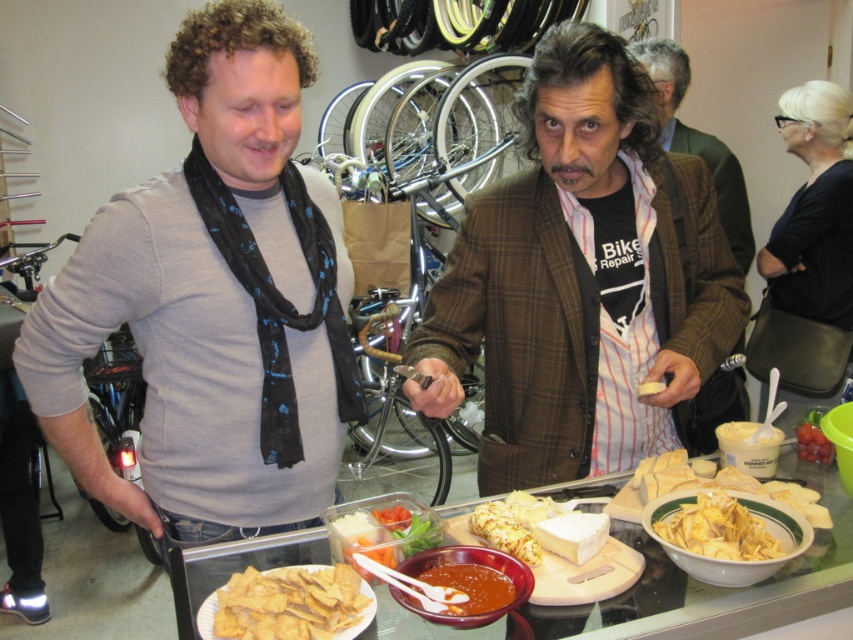
Can you confirm if gray matte shirt at left is positioned to the right of thick brown sauce at center?

In fact, gray matte shirt at left is to the left of thick brown sauce at center.

Can you confirm if gray matte shirt at left is positioned below thick brown sauce at center?

Actually, gray matte shirt at left is above thick brown sauce at center.

Is point (235, 100) positioned behind point (437, 580)?

Yes, point (235, 100) is behind point (437, 580).

Locate an element on the screen. gray matte shirt at left is located at coordinates (213, 301).

Can you confirm if plaid wool jacket at center is shorter than white cheese at center?

No, plaid wool jacket at center is not shorter than white cheese at center.

Does plaid wool jacket at center have a lesser width compared to white cheese at center?

Incorrect, plaid wool jacket at center's width is not less than white cheese at center's.

This screenshot has width=853, height=640. I want to click on plaid wool jacket at center, so click(699, 144).

Does white cheese at center come in front of thick brown sauce at center?

That is False.

Where is `white cheese at center`? The image size is (853, 640). white cheese at center is located at coordinates (538, 528).

Is point (587, 540) in front of point (459, 602)?

No, (587, 540) is behind (459, 602).

Find the location of a particular element. This screenshot has width=853, height=640. white cheese at center is located at coordinates (538, 528).